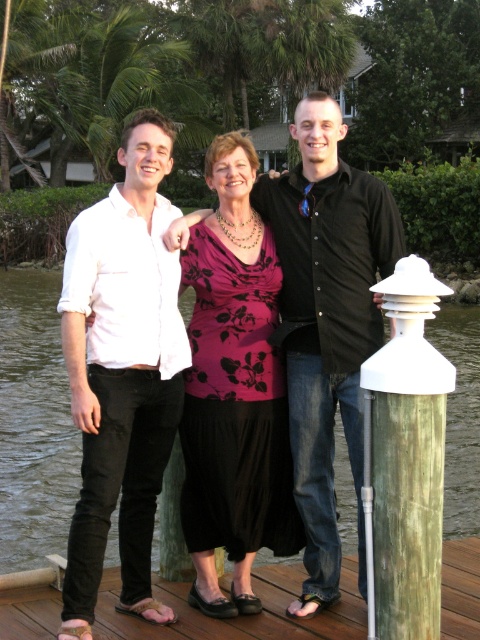
Describe the element at coordinates (121, 372) in the screenshot. I see `white cotton shirt at left` at that location.

Can you confirm if white cotton shirt at left is shorter than floral print blouse at center?

Correct, white cotton shirt at left is not as tall as floral print blouse at center.

Is point (151, 330) in front of point (229, 291)?

Yes.

The height and width of the screenshot is (640, 480). In order to click on white cotton shirt at left in this screenshot , I will do `click(121, 372)`.

Is point (312, 403) in front of point (215, 625)?

No, (312, 403) is behind (215, 625).

Does matte black shirt at center have a lesser width compared to wooden at lower center?

Correct, matte black shirt at center's width is less than wooden at lower center's.

Locate an element on the screen. The width and height of the screenshot is (480, 640). matte black shirt at center is located at coordinates (326, 324).

This screenshot has width=480, height=640. I want to click on matte black shirt at center, so click(326, 324).

Is floral print blouse at center bigger than transparent water at dock center?

No, floral print blouse at center is not bigger than transparent water at dock center.

Between floral print blouse at center and transparent water at dock center, which one has less height?

floral print blouse at center

Who is more distant from viewer, (192, 445) or (478, 470)?

The point (478, 470) is behind.

Where is `floral print blouse at center`? floral print blouse at center is located at coordinates [233, 390].